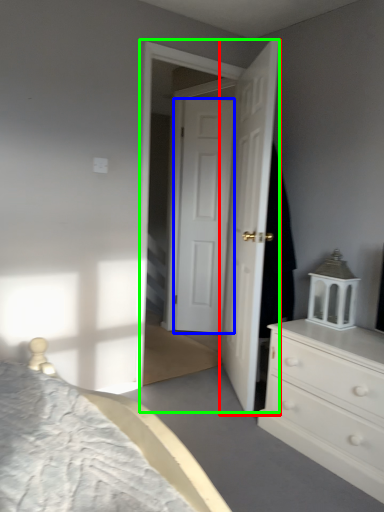
Question: Which object is positioned farthest from door (highlighted by a red box)? Select from door (highlighted by a blue box) and screen door (highlighted by a green box).

Choices:
 (A) door
 (B) screen door

Answer: (A)